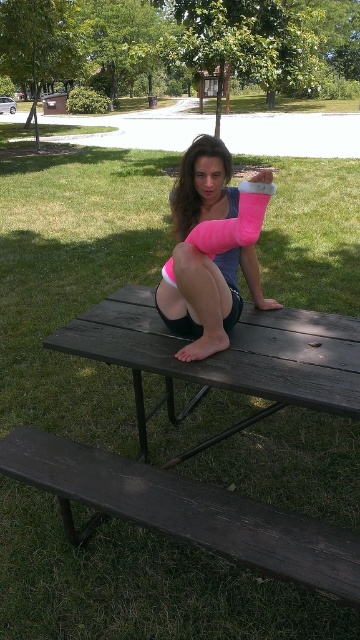
Between dark wood picnic table at center and pink foam cast at center, which one appears on the right side from the viewer's perspective?

Positioned to the right is pink foam cast at center.

Is point (136, 292) positioned behind point (241, 264)?

Yes, it is behind point (241, 264).

Where is `dark wood picnic table at center`? dark wood picnic table at center is located at coordinates (225, 356).

Does dark brown wooden bench at lower left have a lesser height compared to dark wood picnic table at center?

Yes, dark brown wooden bench at lower left is shorter than dark wood picnic table at center.

Between point (52, 449) and point (272, 332), which one is positioned in front?

Point (52, 449)

Is point (190, 522) more distant than point (322, 403)?

Yes.

Identify the location of dark brown wooden bench at lower left. This screenshot has height=640, width=360. pyautogui.click(x=185, y=512).

Is dark brown wooden bench at lower left shorter than pink foam cast at center?

Correct, dark brown wooden bench at lower left is not as tall as pink foam cast at center.

Does dark brown wooden bench at lower left appear on the left side of pink foam cast at center?

Yes, dark brown wooden bench at lower left is to the left of pink foam cast at center.

This screenshot has height=640, width=360. What do you see at coordinates (185, 512) in the screenshot? I see `dark brown wooden bench at lower left` at bounding box center [185, 512].

I want to click on dark brown wooden bench at lower left, so click(x=185, y=512).